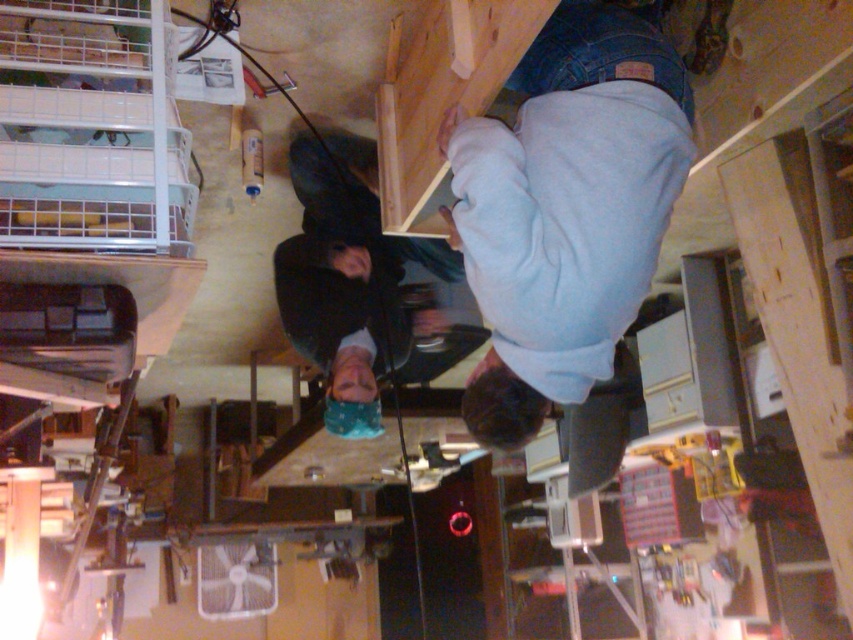
Between light blue cotton shirt at upper center and dark blue fabric at center, which one appears on the left side from the viewer's perspective?

dark blue fabric at center

Between light blue cotton shirt at upper center and dark blue fabric at center, which one has more height?

light blue cotton shirt at upper center is taller.

Which is behind, point (585, 36) or point (363, 426)?

Positioned behind is point (363, 426).

Where is `light blue cotton shirt at upper center`? The image size is (853, 640). light blue cotton shirt at upper center is located at coordinates (566, 209).